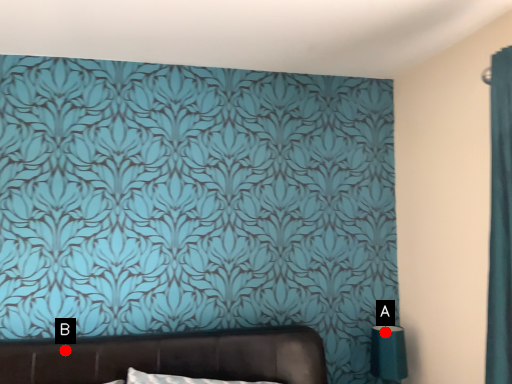
Question: Two points are circled on the image, labeled by A and B beside each circle. Which point is farther to the camera?

Choices:
 (A) A is further
 (B) B is further

Answer: (A)